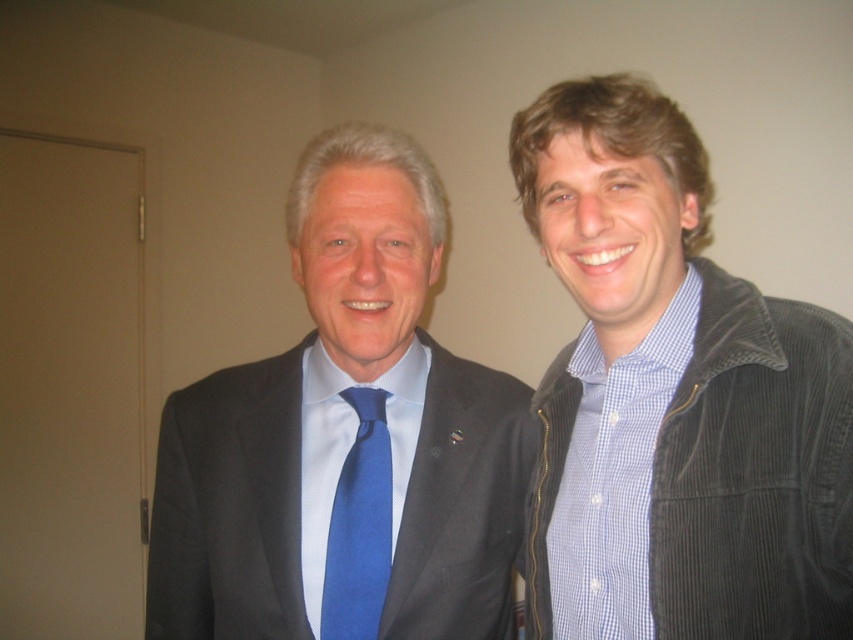
Question: Is corduroy jacket at right behind blue silk tie at center?

Choices:
 (A) no
 (B) yes

Answer: (A)

Question: Is matte black suit at left below blue silk tie at center?

Choices:
 (A) no
 (B) yes

Answer: (A)

Question: Which point is farther from the camera taking this photo?

Choices:
 (A) (798, 499)
 (B) (380, 522)
 (C) (221, 426)

Answer: (C)

Question: Can you confirm if matte black suit at left is positioned to the right of blue silk tie at center?

Choices:
 (A) yes
 (B) no

Answer: (B)

Question: Considering the real-world distances, which object is farthest from the matte black suit at left?

Choices:
 (A) blue silk tie at center
 (B) corduroy jacket at right

Answer: (B)

Question: Among these objects, which one is nearest to the camera?

Choices:
 (A) corduroy jacket at right
 (B) matte black suit at left

Answer: (A)